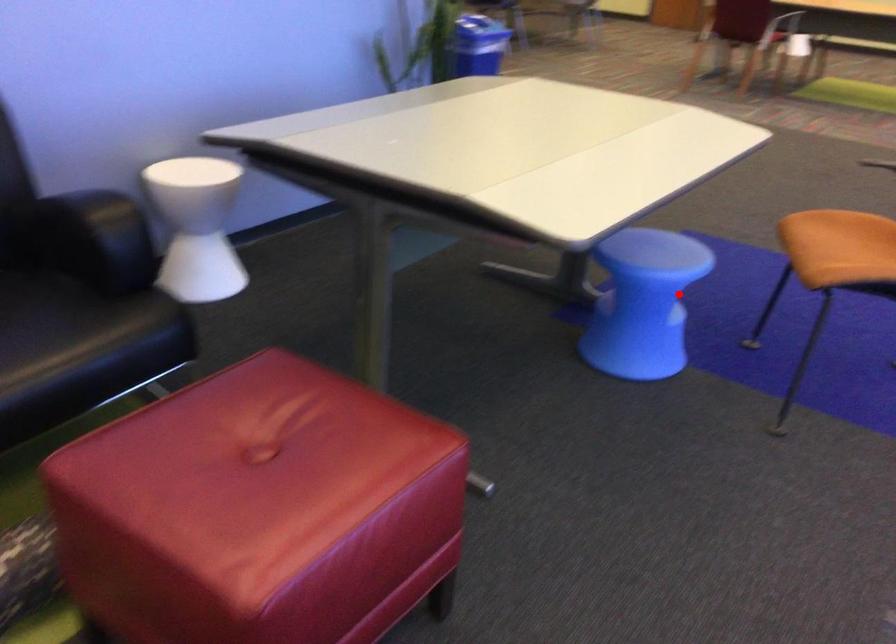
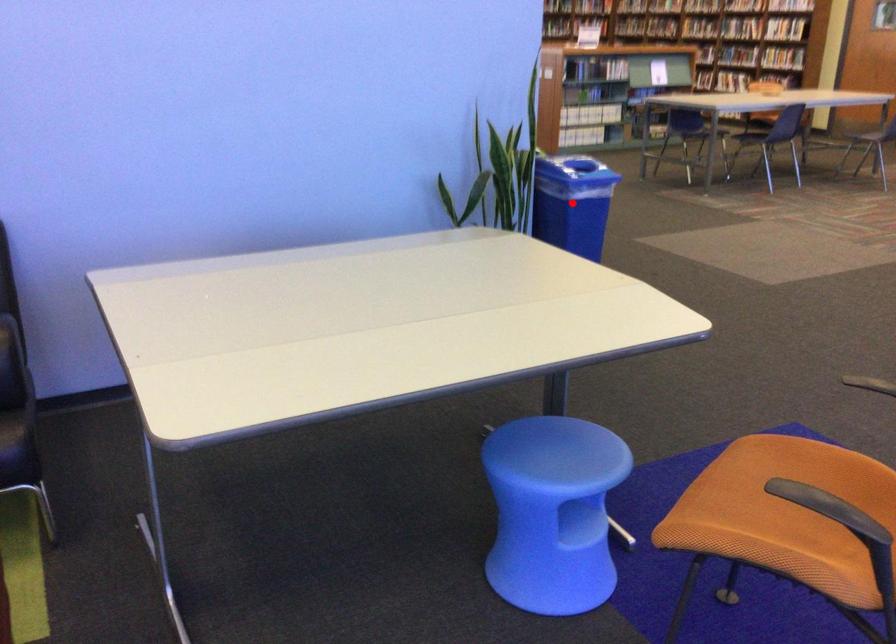
I am providing you with two images of the same scene from different viewpoints. A red point is marked on the first image and another point is marked on the second image. Is the red point in image1 aligned with the point shown in image2?

No